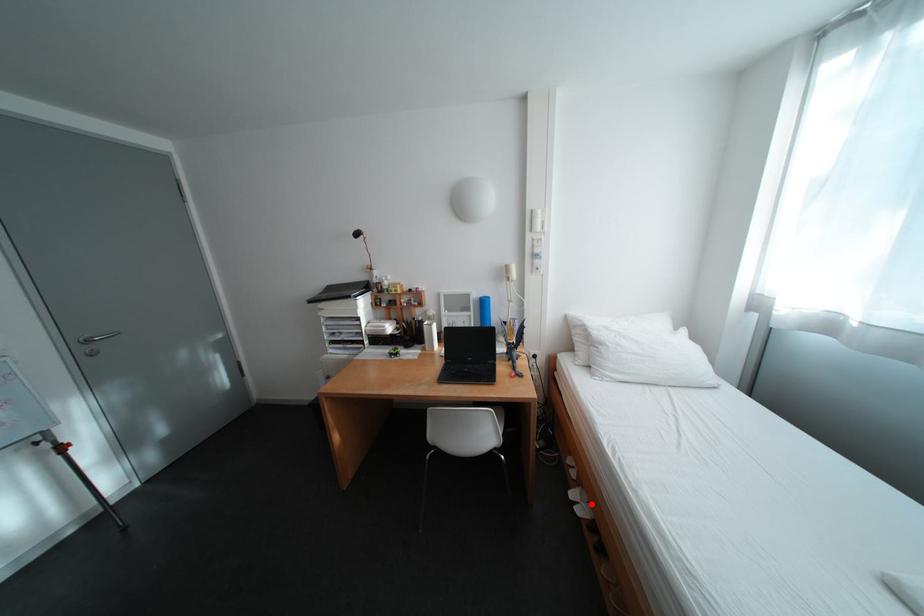
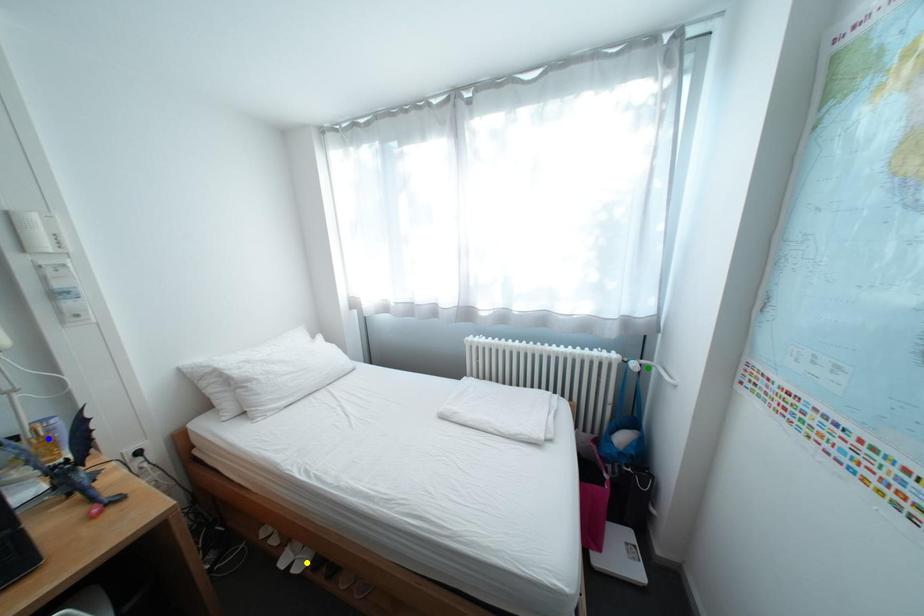
Question: I am providing you with two images of the same scene from different viewpoints. A red point is marked on the first image. You are given multiple points on the second image. Which spot in image 2 lines up with the point in image 1?

Choices:
 (A) blue point
 (B) green point
 (C) yellow point

Answer: (C)